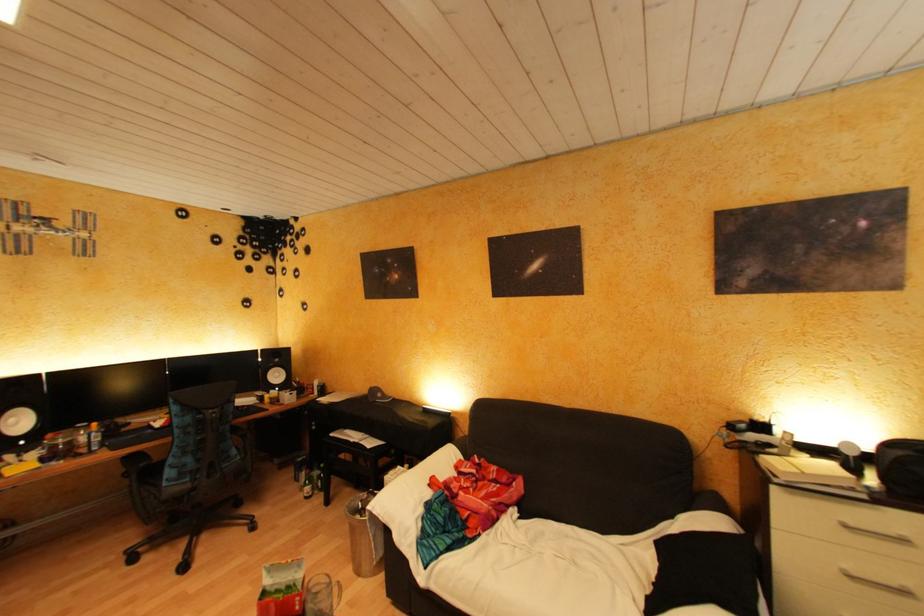
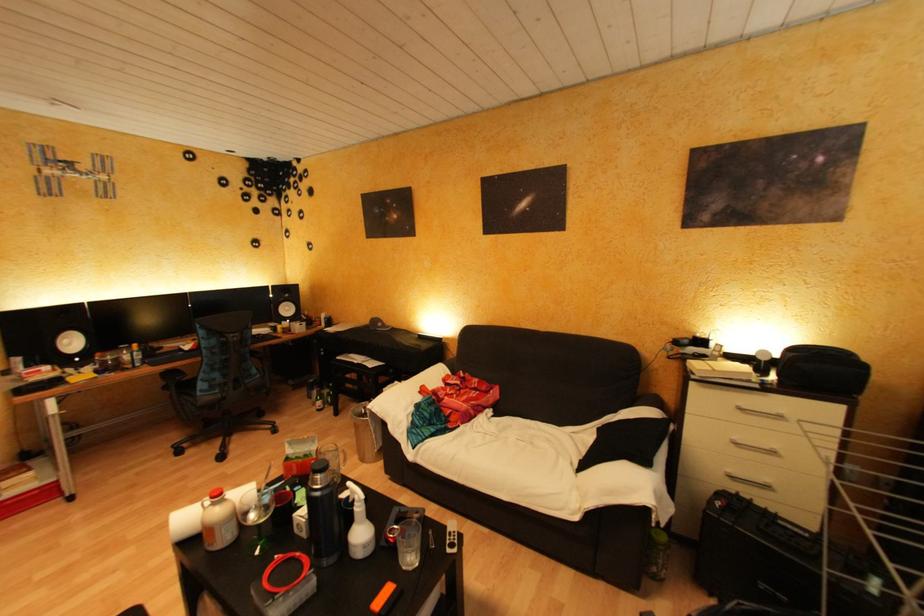
Question: The images are taken continuously from a first-person perspective. In which direction is your viewpoint rotating?

Choices:
 (A) Left
 (B) Right
 (C) Up
 (D) Down

Answer: (D)